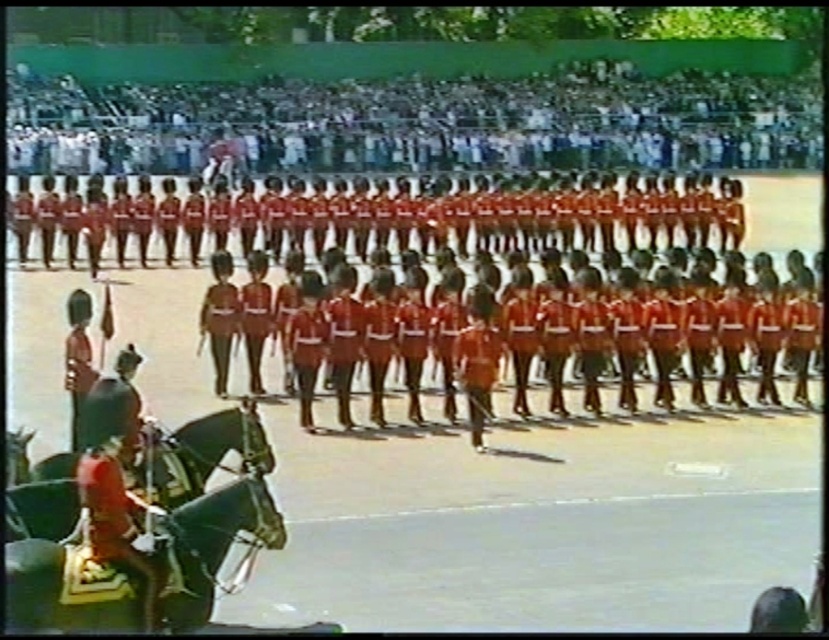
I want to click on shiny red uniform at center, so coord(541,323).

Is point (764, 321) less distant than point (221, 556)?

No, it is behind (221, 556).

At what (x,y) coordinates should I click in order to perform the action: click on shiny red uniform at center. Please return your answer as a coordinate pair (x, y). Looking at the image, I should click on (541, 323).

Is black glossy horse at lower left shorter than shiny red uniform at left?

Yes, black glossy horse at lower left is shorter than shiny red uniform at left.

Who is shorter, black glossy horse at lower left or shiny red uniform at left?

Standing shorter between the two is black glossy horse at lower left.

Is point (192, 420) farther from viewer compared to point (86, 468)?

Yes, it is.

Locate an element on the screen. Image resolution: width=829 pixels, height=640 pixels. black glossy horse at lower left is located at coordinates (200, 454).

What do you see at coordinates (541, 323) in the screenshot? This screenshot has height=640, width=829. I see `shiny red uniform at center` at bounding box center [541, 323].

Does shiny red uniform at center have a smaller size compared to shiny red uniform at left?

Correct, shiny red uniform at center occupies less space than shiny red uniform at left.

At what (x,y) coordinates should I click in order to perform the action: click on shiny red uniform at center. Please return your answer as a coordinate pair (x, y). Looking at the image, I should click on (541, 323).